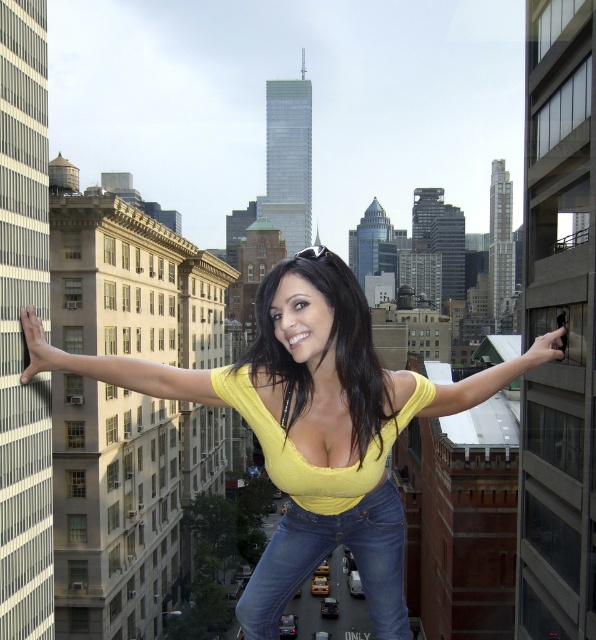
Who is shorter, yellow matte top at center or jeans at center?

With less height is jeans at center.

Who is more forward, (128, 358) or (380, 483)?

A: Positioned in front is point (380, 483).

In order to click on yellow matte top at center in this screenshot , I will do `click(311, 426)`.